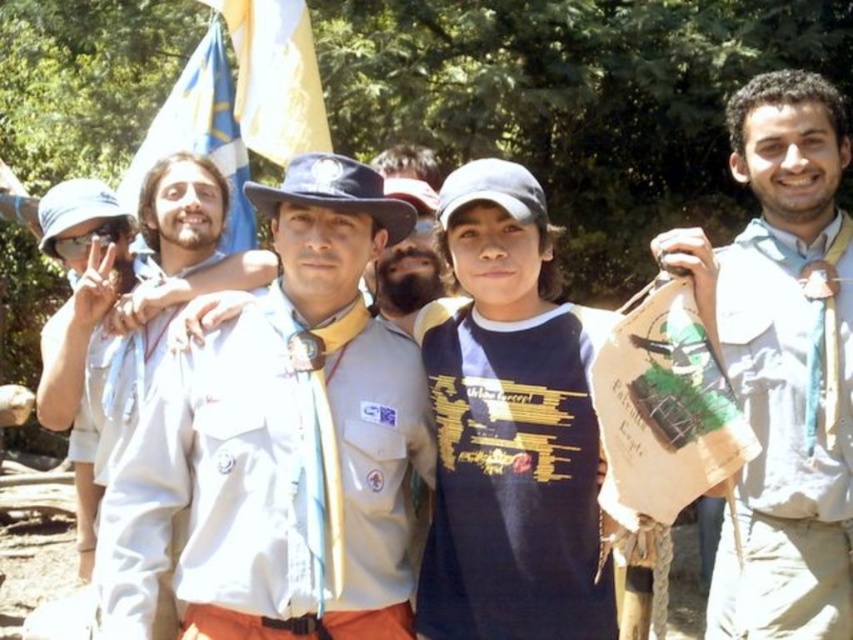
Question: Which object appears closest to the camera in this image?

Choices:
 (A) navy blue jersey at center
 (B) white fabric shirt at left
 (C) blue fabric flag at upper center
 (D) blue fabric flag at upper left

Answer: (A)

Question: Which object is the farthest from the navy blue jersey at center?

Choices:
 (A) white fabric shirt at left
 (B) blue fabric flag at upper center
 (C) blue fabric flag at upper left

Answer: (B)

Question: Which point is farther to the camera?

Choices:
 (A) (759, 435)
 (B) (270, 45)
 (C) (84, 394)

Answer: (B)

Question: Can you confirm if blue fabric flag at upper center is positioned to the right of white cotton shirt at center?

Choices:
 (A) yes
 (B) no

Answer: (A)

Question: Is white fabric uniform at center to the left of white fabric shirt at right from the viewer's perspective?

Choices:
 (A) no
 (B) yes

Answer: (B)

Question: Considering the relative positions of white fabric shirt at right and white cotton shirt at center in the image provided, where is white fabric shirt at right located with respect to white cotton shirt at center?

Choices:
 (A) right
 (B) left

Answer: (A)